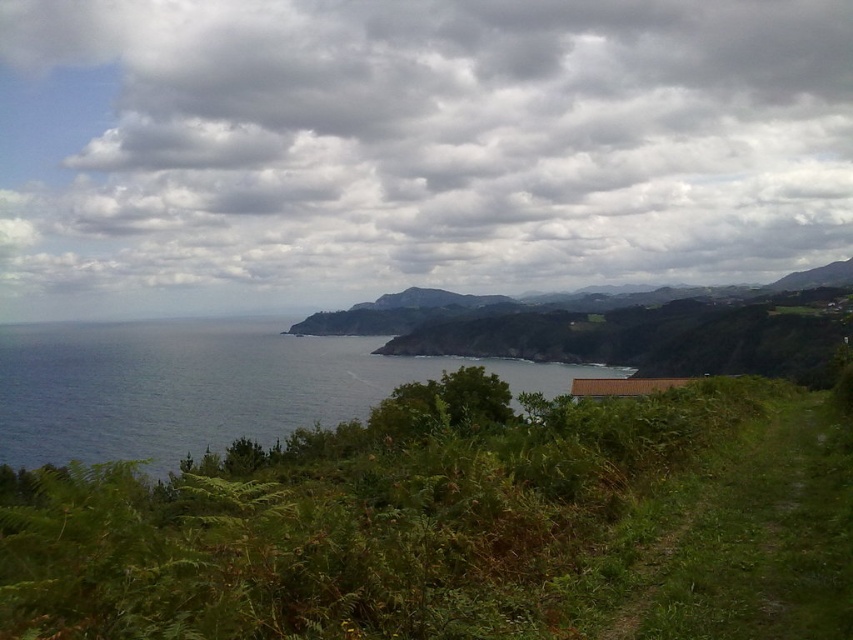
You are standing at the point marked as point (354, 520) in the image. Based on the scene description, what type of terrain or vegetation are you currently standing on?

You are standing on green leafy shrubs at lower left.

You are a hiker standing at the start of the dirt path. You want to take a photo of the cloudy sky at upper center and the green leafy shrubs at lower left in the same frame. Which object will appear bigger in your photo?

The cloudy sky at upper center will appear bigger in the photo because it has a larger size compared to the green leafy shrubs at lower left.

You are a hiker who wants to cross from the green leafy shrubs at lower left to the blue water at left. The path is narrow and has a slight curve to the right. Given the distance between them is 53.73 meters, can you safely make the crossing without needing to backtrack?

The distance between the green leafy shrubs at lower left and the blue water at left is 53.73 meters. Since the path is narrow and curves slightly to the right but there is no mention of obstacles, you can safely proceed forward without needing to backtrack.